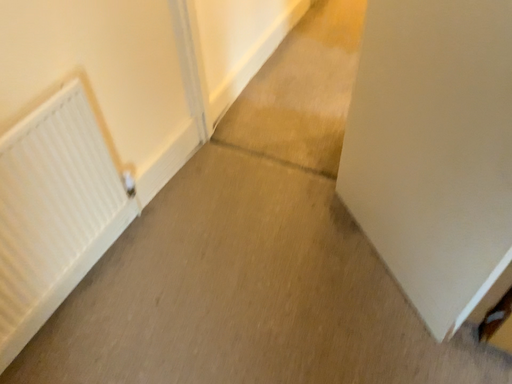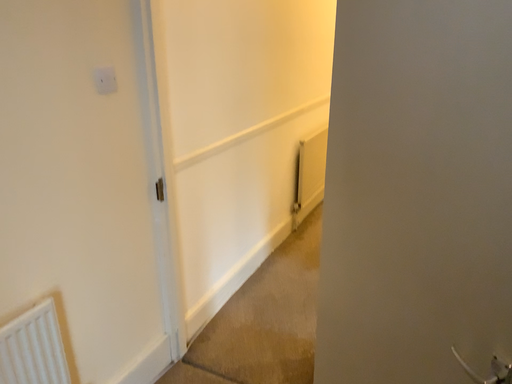
Question: Which way did the camera rotate in the video?

Choices:
 (A) rotated downward
 (B) rotated upward

Answer: (B)